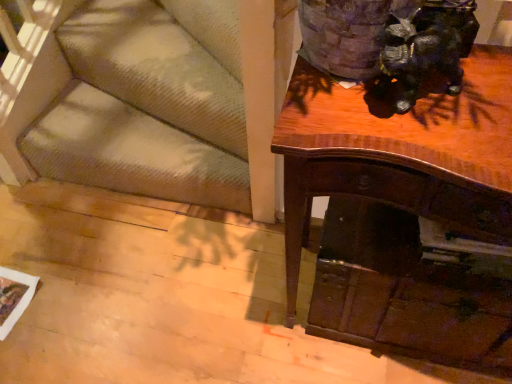
The width and height of the screenshot is (512, 384). I want to click on free location to the left of shiny brown desk at upper right, so click(x=226, y=299).